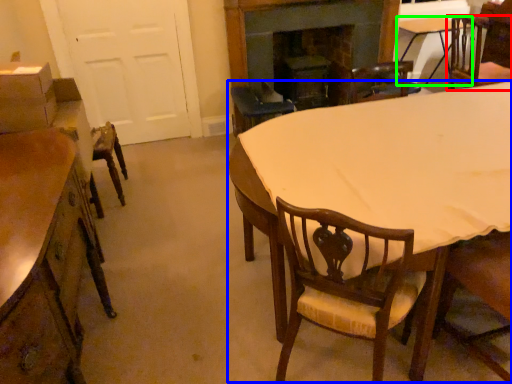
Question: Which object is positioned closest to chair (highlighted by a red box)? Select from kitchen & dining room table (highlighted by a blue box) and table (highlighted by a green box).

Choices:
 (A) kitchen & dining room table
 (B) table

Answer: (B)